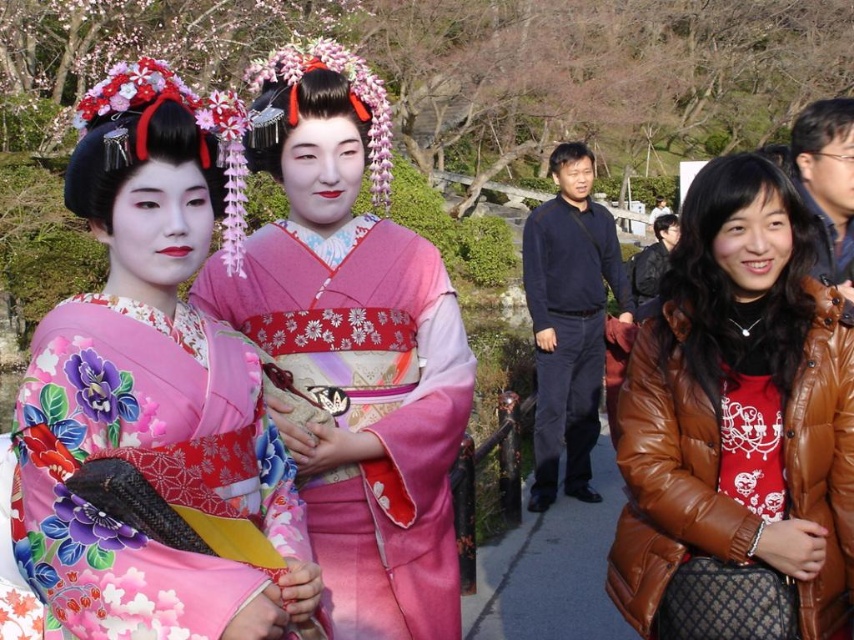
Does brown leather jacket at right come behind matte pink kimono at center?

No, brown leather jacket at right is closer to the viewer.

Is point (627, 547) more distant than point (221, 314)?

No, (627, 547) is in front of (221, 314).

I want to click on brown leather jacket at right, so click(x=736, y=428).

From the picture: Is matte kimono at left shorter than dark blue sweater at center?

Yes.

Is point (288, 381) farther from viewer compared to point (592, 403)?

That is False.

Locate an element on the screen. The image size is (854, 640). matte kimono at left is located at coordinates (154, 401).

From the picture: Does matte kimono at left appear on the right side of matte pink kimono at center?

In fact, matte kimono at left is to the left of matte pink kimono at center.

Is point (162, 467) positioned before point (418, 452)?

That is True.

Measure the distance between matte kimono at left and camera.

matte kimono at left and camera are 5.00 meters apart from each other.

Identify the location of matte kimono at left. This screenshot has height=640, width=854. (154, 401).